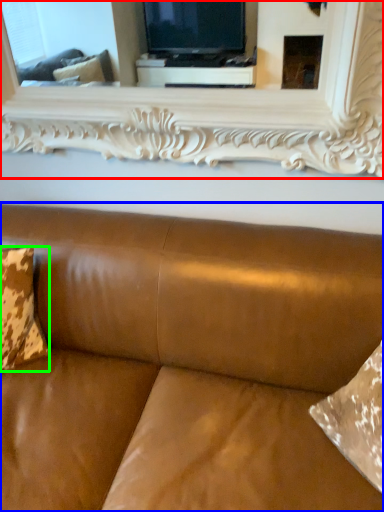
Question: Considering the real-world distances, which object is closest to mirror (highlighted by a red box)? studio couch (highlighted by a blue box) or pillow (highlighted by a green box).

Choices:
 (A) studio couch
 (B) pillow

Answer: (A)